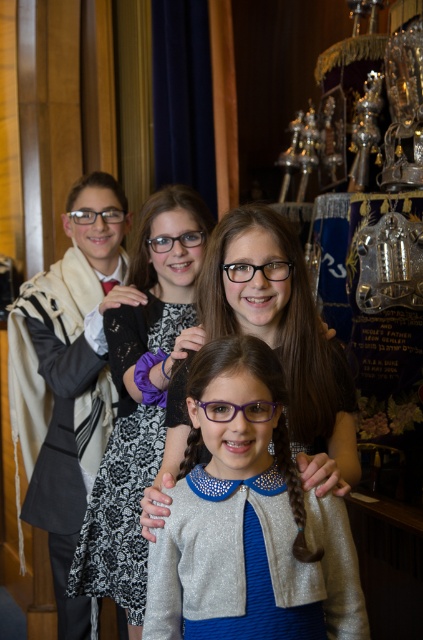
You are a photographer taking a picture of the shiny silver cardigan at center and the purple plastic glasses at center. Which object should you adjust to the right to center both items in the frame?

The shiny silver cardigan at center is positioned on the left side of the purple plastic glasses at center. To center both items in the frame, move the shiny silver cardigan at center to the right so it aligns with the purple plastic glasses at center.

In the scene shown: You are a photographer arranging two items for a photo shoot. You have the shiny silver cardigan at center and the black lace dress at center. Which item should you place on the smaller mannequin to ensure it fits properly?

The shiny silver cardigan at center has a smaller size compared to black lace dress at center, so it should be placed on the smaller mannequin to ensure proper fit.

You are a photographer trying to capture a clear photo of the shiny silver cardigan at center and the purple plastic glasses at center. Which object will appear larger in the photo?

The shiny silver cardigan at center will appear larger in the photo because it is much taller than the purple plastic glasses at center.